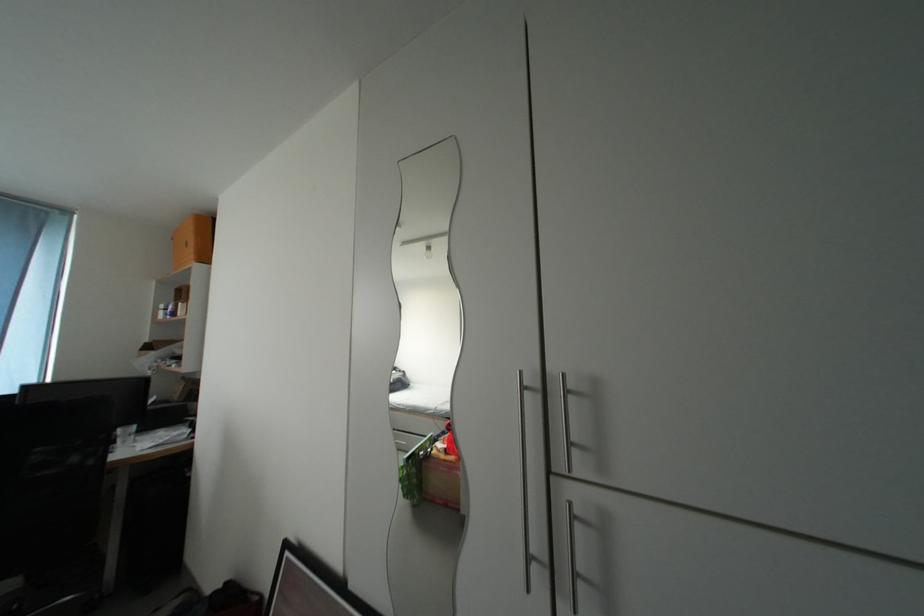
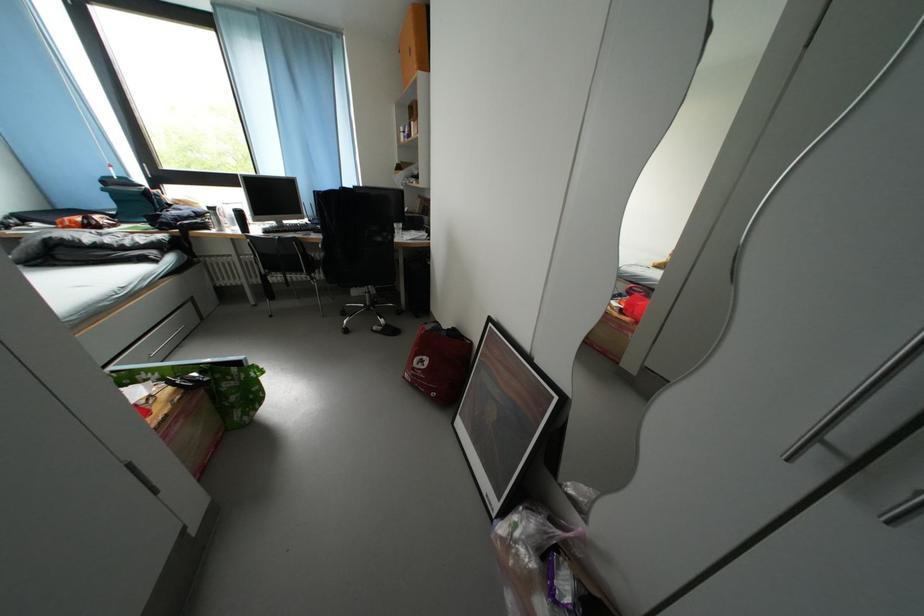
The images are taken continuously from a first-person perspective. In which direction is your viewpoint rotating?

The rotation direction of the camera is left-down.